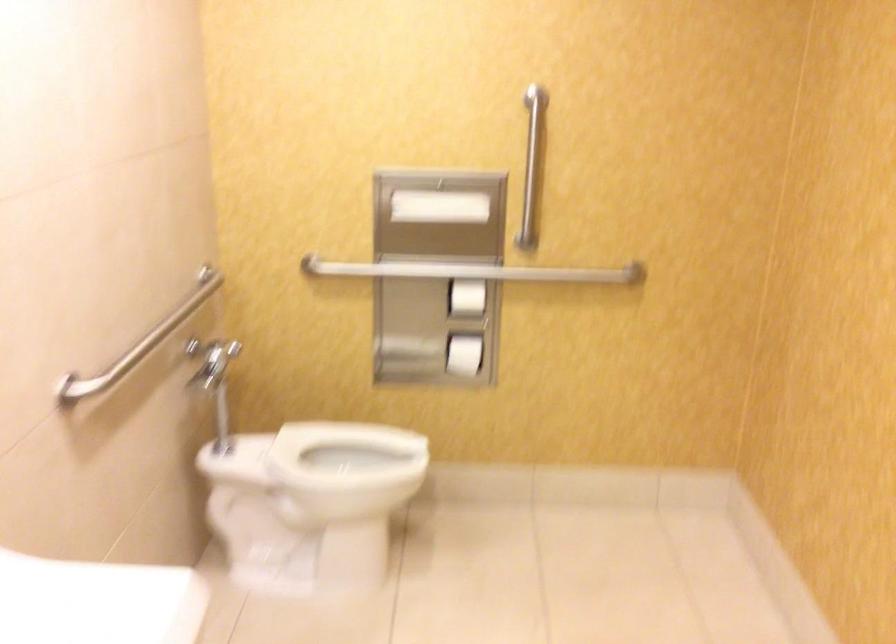
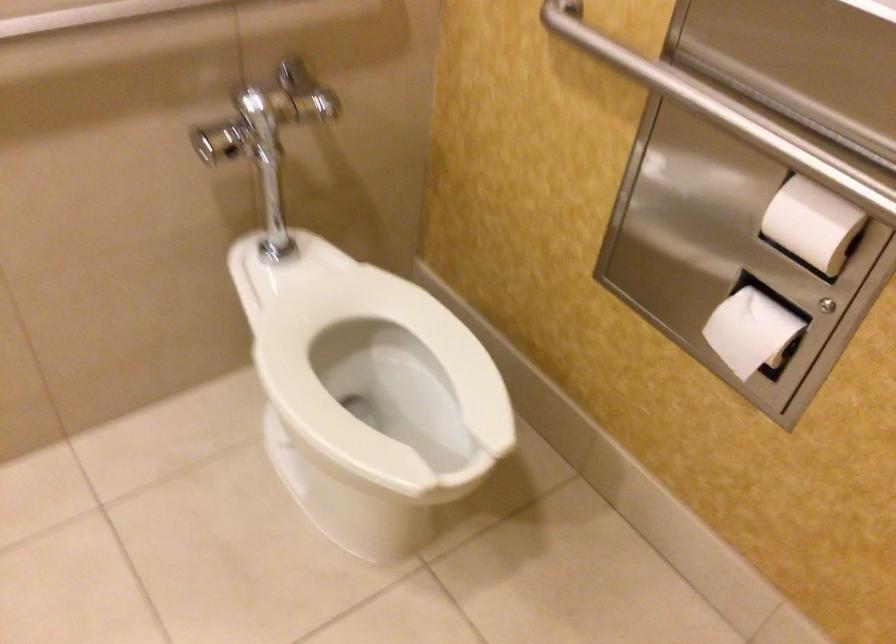
Where in the second image is the point corresponding to [428,269] from the first image?

(725, 111)